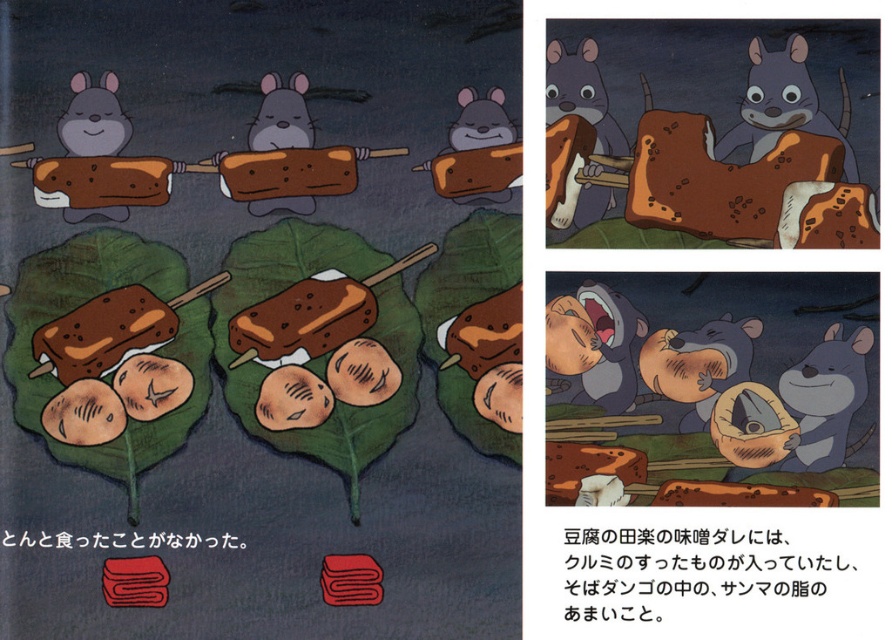
In the two panels of the comic strip, you notice a gray furry mouse at lower right and a brown textured ice cream at center. Based on their sizes, which one is more likely to be the main character?

The gray furry mouse at lower right is much taller than the brown textured ice cream at center, making it more likely to be the main character due to its prominence in size.

In the comic strip, you see the brown matte wood skewer at upper center and the matte gray mouse at upper left. Which object is positioned lower in the image?

The brown matte wood skewer at upper center is located below the matte gray mouse at upper left, so it is positioned lower in the image.

In the left panel of the comic strip, there are three mice holding skewers with grilled items over green leaves. The brown matte wood skewer at upper center is represented by point [581,93]. Can you determine the position of the brown matte wood skewer at upper center relative to the other skewers?

The brown matte wood skewer at upper center is located at point [581,93], which is the upper center position relative to the other skewers in the left panel.